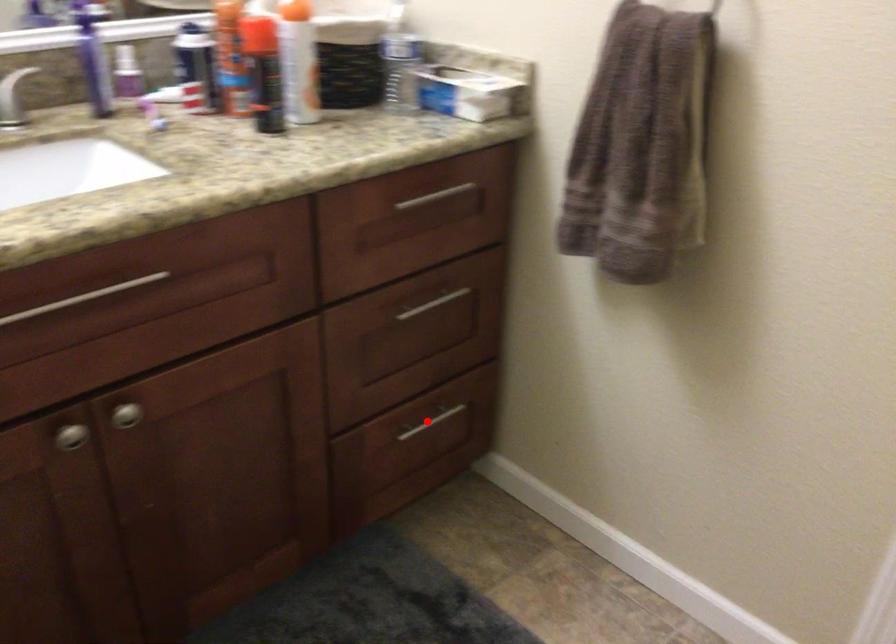
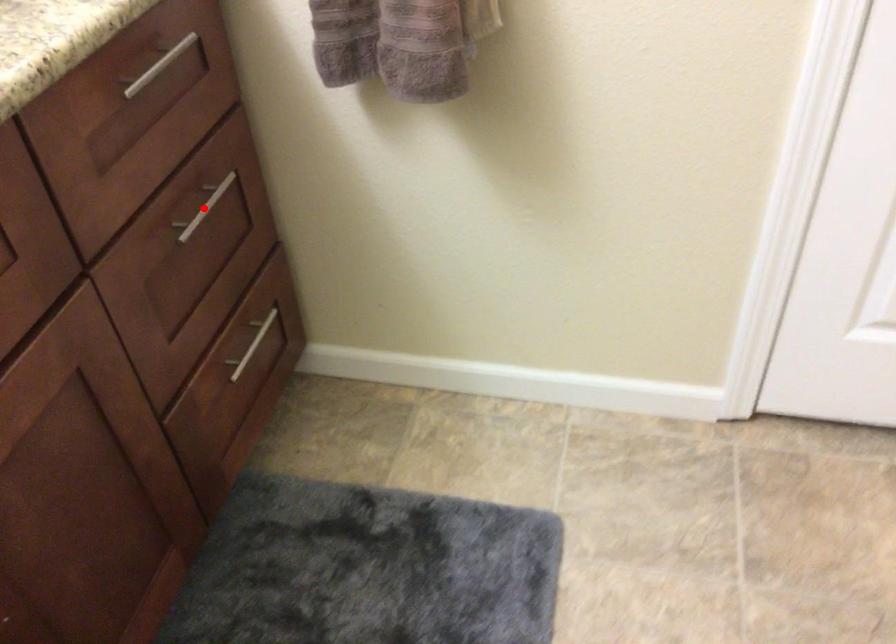
I am providing you with two images of the same scene from different viewpoints. A red point is marked on the first image and another point is marked on the second image. Are the points marked in image1 and image2 representing the same 3D position?

No